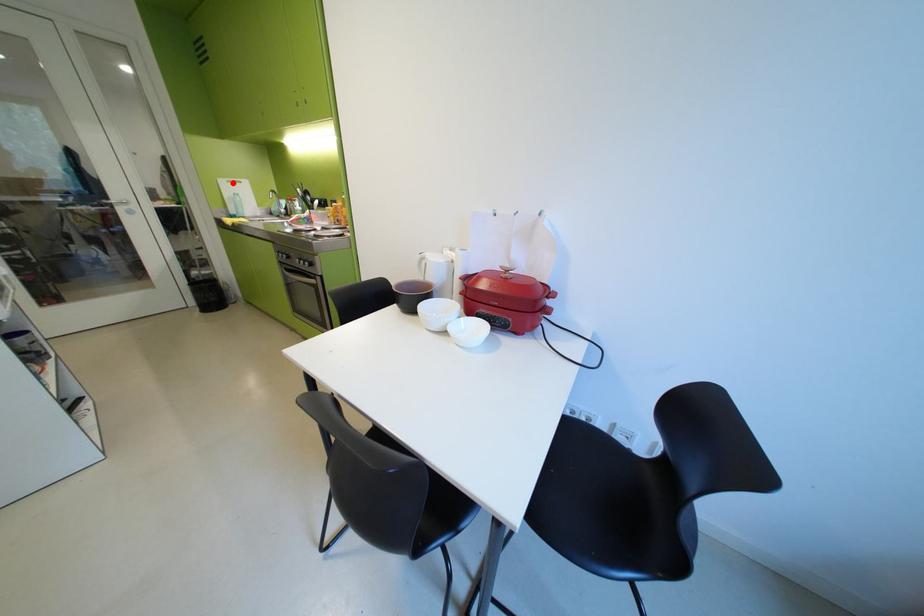
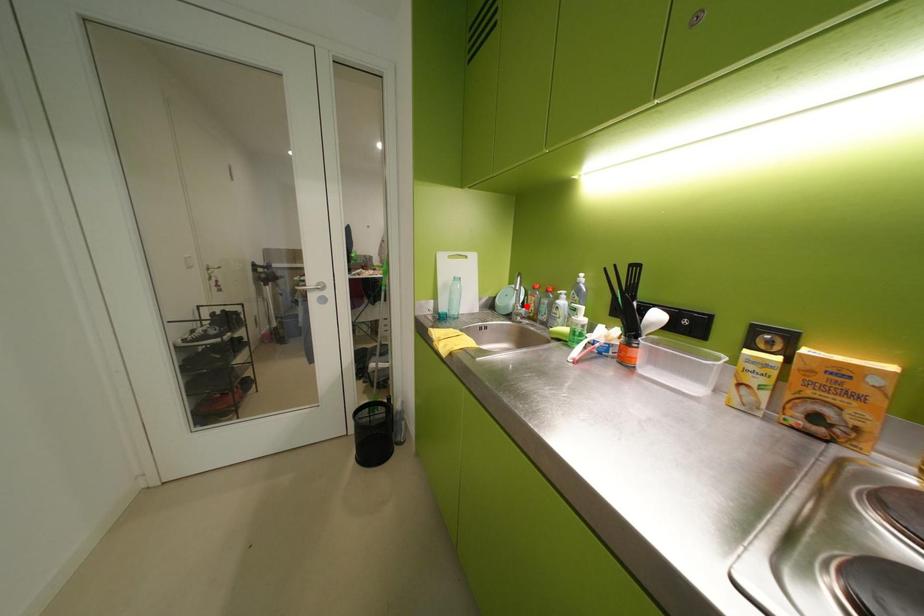
I am providing you with two images of the same scene from different viewpoints. A red point is marked on the first image and another point is marked on the second image. Is the red point in image1 aligned with the point shown in image2?

No